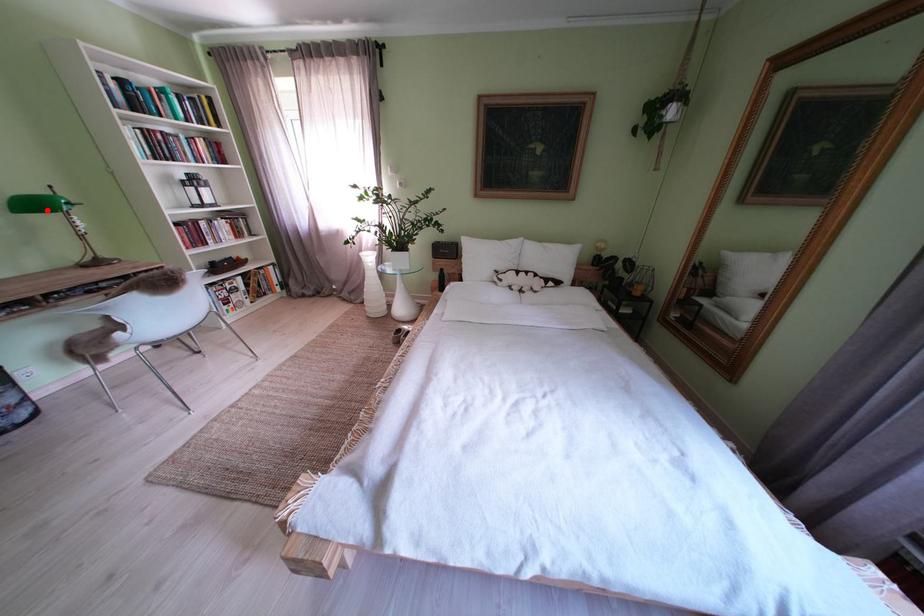
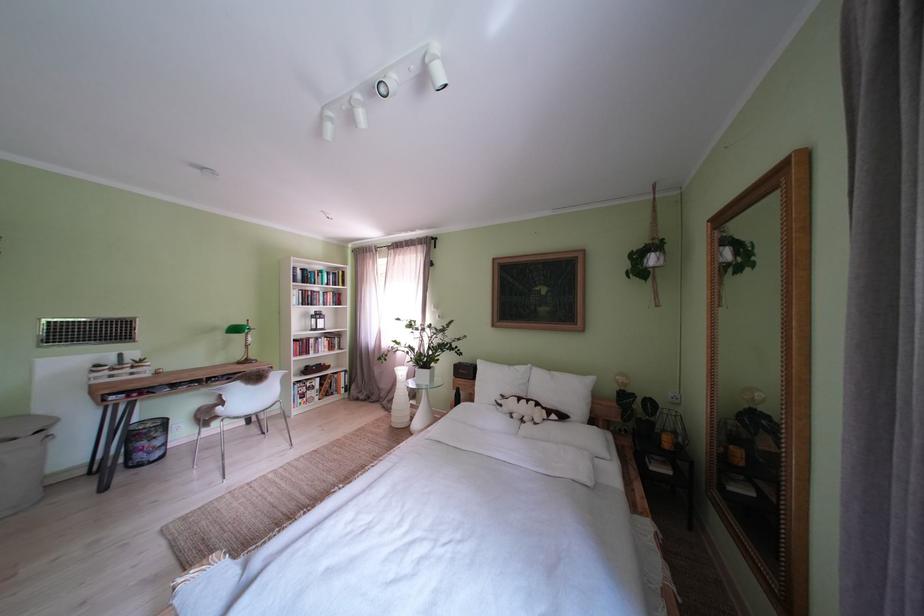
Locate, in the second image, the point that corresponds to the highlighted location in the first image.

(247, 334)